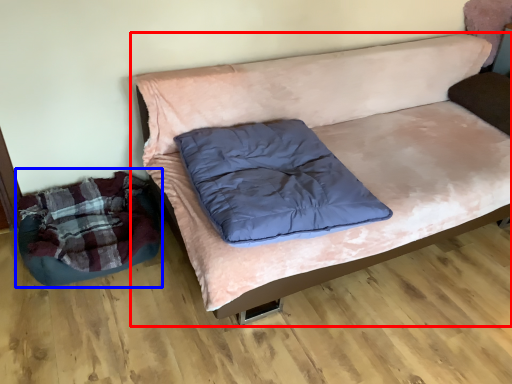
Question: Which object is further to the camera taking this photo, studio couch (highlighted by a red box) or bean bag chair (highlighted by a blue box)?

Choices:
 (A) studio couch
 (B) bean bag chair

Answer: (B)